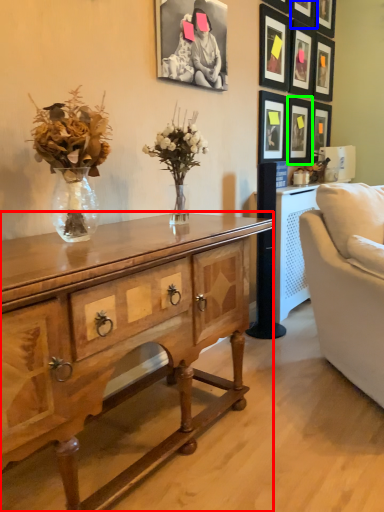
Question: Based on their relative distances, which object is nearer to desk (highlighted by a red box)? Choose from picture frame (highlighted by a blue box) and picture frame (highlighted by a green box).

Choices:
 (A) picture frame
 (B) picture frame

Answer: (B)